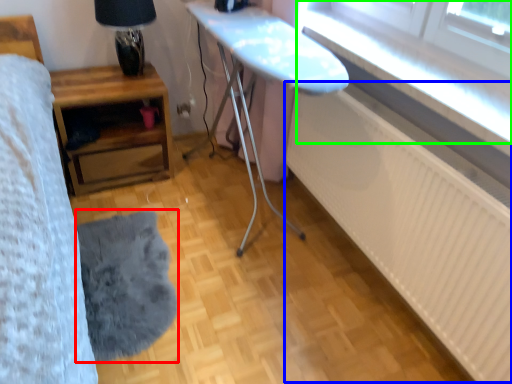
Question: Which object is the closest to the mat (highlighted by a red box)? Choose among these: radiator (highlighted by a blue box) or window (highlighted by a green box).

Choices:
 (A) radiator
 (B) window

Answer: (A)